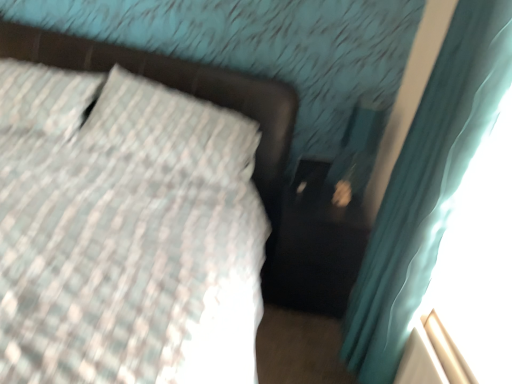
Describe the element at coordinates (426, 186) in the screenshot. I see `teal fabric curtain at right` at that location.

The image size is (512, 384). I want to click on teal fabric curtain at right, so click(x=426, y=186).

The height and width of the screenshot is (384, 512). Find the location of `matte black bed frame at upper left`. matte black bed frame at upper left is located at coordinates (174, 85).

What do you see at coordinates (174, 85) in the screenshot? I see `matte black bed frame at upper left` at bounding box center [174, 85].

In order to face matte black bed frame at upper left, should I rotate leftwards or rightwards?

To face it directly, rotate left by 11.181 degrees.

The height and width of the screenshot is (384, 512). In order to click on teal fabric curtain at right in this screenshot , I will do `click(426, 186)`.

Based on the photo, considering the relative positions of teal fabric curtain at right and matte black bed frame at upper left in the image provided, is teal fabric curtain at right to the right of matte black bed frame at upper left from the viewer's perspective?

Indeed, teal fabric curtain at right is positioned on the right side of matte black bed frame at upper left.

Does teal fabric curtain at right come behind matte black bed frame at upper left?

No.

Between point (434, 168) and point (178, 85), which one is positioned behind?

Point (178, 85)

From the image's perspective, is teal fabric curtain at right above matte black bed frame at upper left?

Incorrect, from the image's perspective, teal fabric curtain at right is lower than matte black bed frame at upper left.

From a real-world perspective, is teal fabric curtain at right located beneath matte black bed frame at upper left?

Actually, teal fabric curtain at right is physically above matte black bed frame at upper left in the real world.

Consider the image. Is teal fabric curtain at right wider or thinner than matte black bed frame at upper left?

Considering their sizes, teal fabric curtain at right looks slimmer than matte black bed frame at upper left.

Does teal fabric curtain at right have a greater height compared to matte black bed frame at upper left?

Yes, teal fabric curtain at right is taller than matte black bed frame at upper left.

Considering the relative sizes of teal fabric curtain at right and matte black bed frame at upper left in the image provided, is teal fabric curtain at right bigger than matte black bed frame at upper left?

Incorrect, teal fabric curtain at right is not larger than matte black bed frame at upper left.

Is teal fabric curtain at right spatially inside matte black bed frame at upper left, or outside of it?

teal fabric curtain at right is not enclosed by matte black bed frame at upper left.

Is the surface of teal fabric curtain at right in direct contact with matte black bed frame at upper left?

No, teal fabric curtain at right is not with matte black bed frame at upper left.

Is teal fabric curtain at right positioned with its back to matte black bed frame at upper left?

teal fabric curtain at right does not have its back to matte black bed frame at upper left.

How many degrees apart are the facing directions of teal fabric curtain at right and matte black bed frame at upper left?

The angle between the facing direction of teal fabric curtain at right and the facing direction of matte black bed frame at upper left is 92.7 degrees.

How distant is teal fabric curtain at right from matte black bed frame at upper left?

teal fabric curtain at right and matte black bed frame at upper left are 3.33 feet apart from each other.

In the image, there is a matte black bed frame at upper left. At what (x,y) coordinates should I click in order to perform the action: click on curtain below it (from the image's perspective). Please return your answer as a coordinate pair (x, y). This screenshot has height=384, width=512. Looking at the image, I should click on (426, 186).

Between matte black bed frame at upper left and teal fabric curtain at right, which one appears on the left side from the viewer's perspective?

From the viewer's perspective, matte black bed frame at upper left appears more on the left side.

Is matte black bed frame at upper left positioned in front of teal fabric curtain at right?

No, matte black bed frame at upper left is further to the viewer.

Based on the photo, which is nearer, (250, 85) or (414, 168)?

Point (250, 85) is farther from the camera than point (414, 168).

From the image's perspective, is matte black bed frame at upper left positioned above or below teal fabric curtain at right?

Clearly, from the image's perspective, matte black bed frame at upper left is above teal fabric curtain at right.

From a real-world perspective, is matte black bed frame at upper left above or below teal fabric curtain at right?

matte black bed frame at upper left is below teal fabric curtain at right.

Which of these two, matte black bed frame at upper left or teal fabric curtain at right, is wider?

Wider between the two is matte black bed frame at upper left.

Considering the sizes of matte black bed frame at upper left and teal fabric curtain at right in the image, is matte black bed frame at upper left taller or shorter than teal fabric curtain at right?

matte black bed frame at upper left is shorter than teal fabric curtain at right.

From the picture: Between matte black bed frame at upper left and teal fabric curtain at right, which one has smaller size?

teal fabric curtain at right is smaller.

Would you say matte black bed frame at upper left is inside or outside teal fabric curtain at right?

matte black bed frame at upper left is not enclosed by teal fabric curtain at right.

Is there a large distance between matte black bed frame at upper left and teal fabric curtain at right?

matte black bed frame at upper left is positioned a significant distance from teal fabric curtain at right.

Does matte black bed frame at upper left turn towards teal fabric curtain at right?

No, matte black bed frame at upper left is not facing towards teal fabric curtain at right.

How many degrees apart are the facing directions of matte black bed frame at upper left and teal fabric curtain at right?

The angular difference between matte black bed frame at upper left and teal fabric curtain at right is 92.7 degrees.

How far apart are matte black bed frame at upper left and teal fabric curtain at right?

3.33 feet.

This screenshot has height=384, width=512. Find the location of `bed frame that is behind the teal fabric curtain at right`. bed frame that is behind the teal fabric curtain at right is located at coordinates (174, 85).

The height and width of the screenshot is (384, 512). I want to click on bed frame directly beneath the teal fabric curtain at right (from a real-world perspective), so click(x=174, y=85).

Find the location of `bed frame that appears behind the teal fabric curtain at right`. bed frame that appears behind the teal fabric curtain at right is located at coordinates coord(174,85).